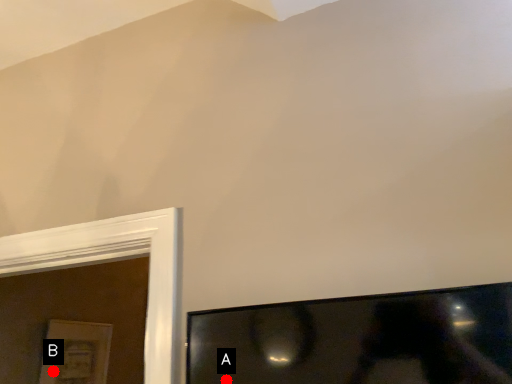
Question: Two points are circled on the image, labeled by A and B beside each circle. Which point is further to the camera?

Choices:
 (A) A is further
 (B) B is further

Answer: (B)